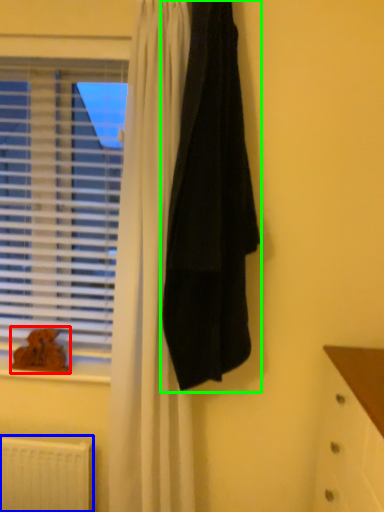
Question: Which object is the farthest from animal (highlighted by a red box)? Choose among these: radiator (highlighted by a blue box) or towel (highlighted by a green box).

Choices:
 (A) radiator
 (B) towel

Answer: (B)